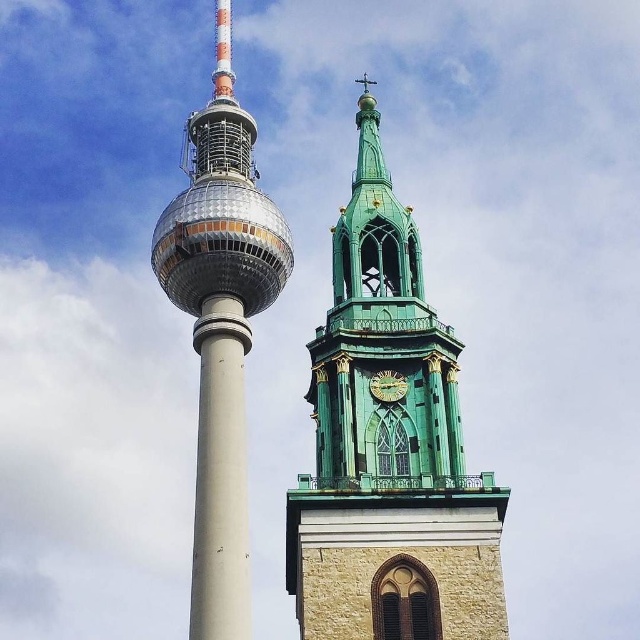
You are an architect analyzing the image. Which object, the green stone clock tower at upper right or the green stone clock at center, would require more materials to construct a scale model if both are to be built to the same height?

The green stone clock tower at upper right requires more materials to construct a scale model because it is much taller than the green stone clock at center.

Based on the scene description, what object is located at the coordinates point (220, 326)?

The shiny metallic tower at left is located at point (220, 326).

You are an architect analyzing the spatial relationship between the shiny metallic tower at left and the white concrete pillar at center. Which structure occupies more horizontal space in the image?

The shiny metallic tower at left has a larger size compared to the white concrete pillar at center, so it occupies more horizontal space in the image.